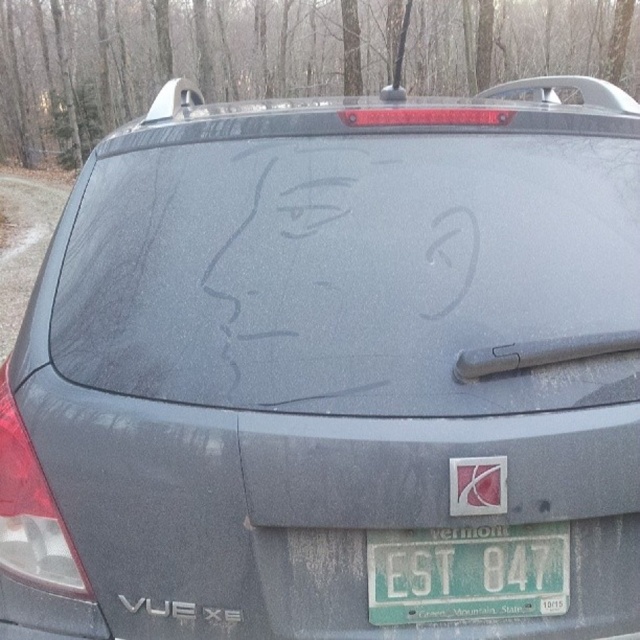
You are standing behind the gray Chevrolet Vue XE and want to walk from the point at coordinate (486, 476) to the point at coordinate (132, 609). Which direction should you move relative to the car?

You should move towards the front of the car because point (486, 476) is in front of point (132, 609).

You are a delivery driver who needs to read the license plate of the gray Chevrolet Vue XE. You notice the frosted glass drawing at center and the green matte license plate at lower center. Which object is closer to you as you approach the car?

The frosted glass drawing at center is closer to you because it is in front of the green matte license plate at lower center.